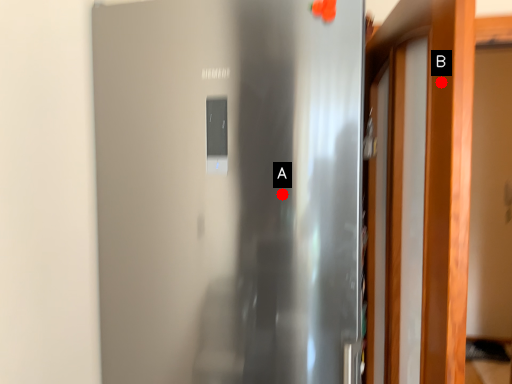
Question: Two points are circled on the image, labeled by A and B beside each circle. Which point is closer to the camera?

Choices:
 (A) A is closer
 (B) B is closer

Answer: (B)